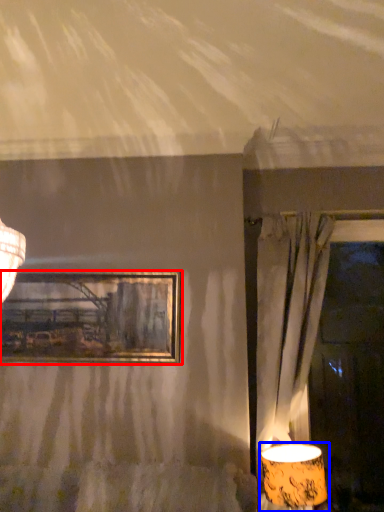
Question: Which object is closer to the camera taking this photo, picture frame (highlighted by a red box) or lamp (highlighted by a blue box)?

Choices:
 (A) picture frame
 (B) lamp

Answer: (B)